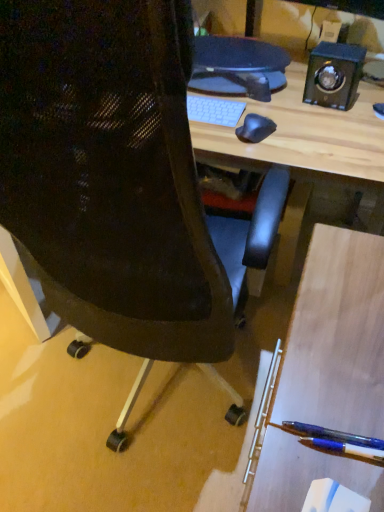
Question: Which is correct: translucent blue pen at lower right is inside black polished wood speaker at upper right, or outside of it?

Choices:
 (A) inside
 (B) outside

Answer: (B)

Question: Relative to black polished wood speaker at upper right, is translucent blue pen at lower right in front or behind?

Choices:
 (A) front
 (B) behind

Answer: (A)

Question: Estimate the real-world distances between objects in this image. Which object is closer to the blue glossy pen at lower right?

Choices:
 (A) black polished wood speaker at upper right
 (B) black mesh chair at center
 (C) translucent blue pen at lower right

Answer: (C)

Question: Estimate the real-world distances between objects in this image. Which object is closer to the translucent blue pen at lower right?

Choices:
 (A) blue glossy pen at lower right
 (B) black polished wood speaker at upper right
 (C) black mesh chair at center

Answer: (A)